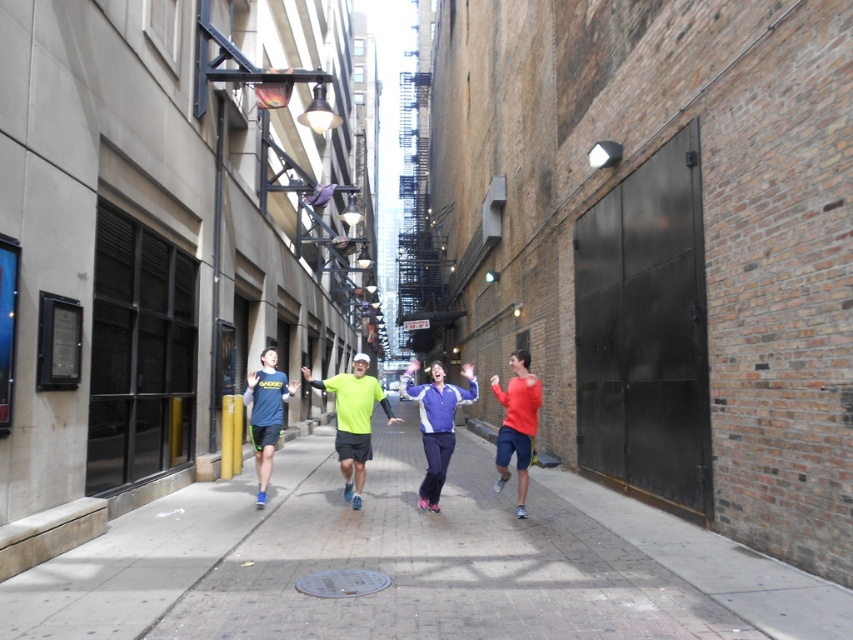
Does brick pavement at center have a lesser width compared to neon green fabric at center?

No, brick pavement at center is not thinner than neon green fabric at center.

Is brick pavement at center behind neon green fabric at center?

No, brick pavement at center is closer to the viewer.

Between point (354, 531) and point (350, 426), which one is positioned behind?

The point (350, 426) is more distant.

Identify the location of brick pavement at center. This screenshot has height=640, width=853. (415, 564).

Does point (437, 380) lie in front of point (270, 348)?

Yes, point (437, 380) is closer to viewer.

Who is taller, vibrant purple track suit at center or matte blue shirt at center?

vibrant purple track suit at center

Describe the element at coordinates (436, 422) in the screenshot. I see `vibrant purple track suit at center` at that location.

Where is `vibrant purple track suit at center`? This screenshot has height=640, width=853. vibrant purple track suit at center is located at coordinates (436, 422).

Between neon green fabric at center and vibrant purple track suit at center, which one has more height?

Standing taller between the two is vibrant purple track suit at center.

Does neon green fabric at center appear over vibrant purple track suit at center?

Indeed, neon green fabric at center is positioned over vibrant purple track suit at center.

What do you see at coordinates (352, 420) in the screenshot? I see `neon green fabric at center` at bounding box center [352, 420].

Locate an element on the screen. This screenshot has width=853, height=640. neon green fabric at center is located at coordinates (352, 420).